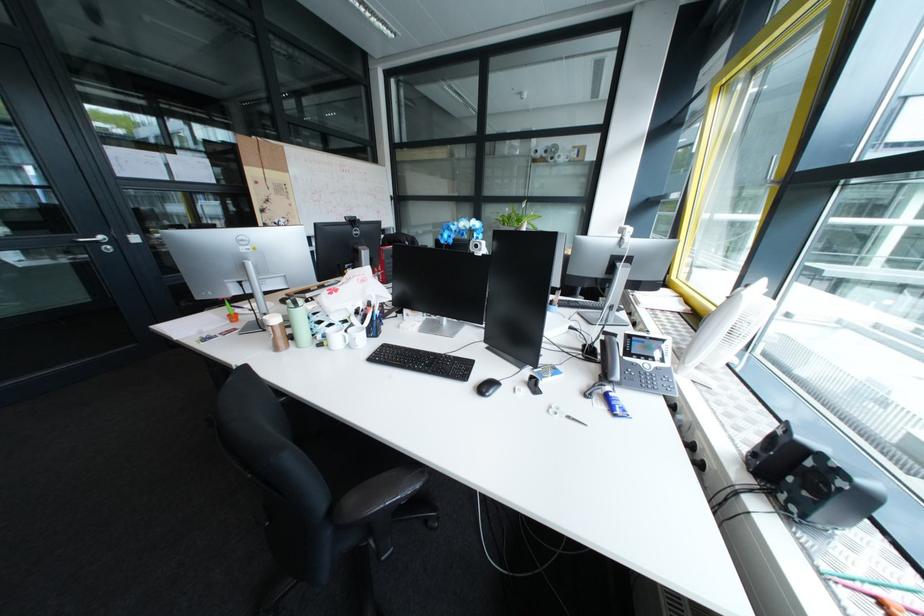
The width and height of the screenshot is (924, 616). Identify the location of white mug handle. (347, 337).